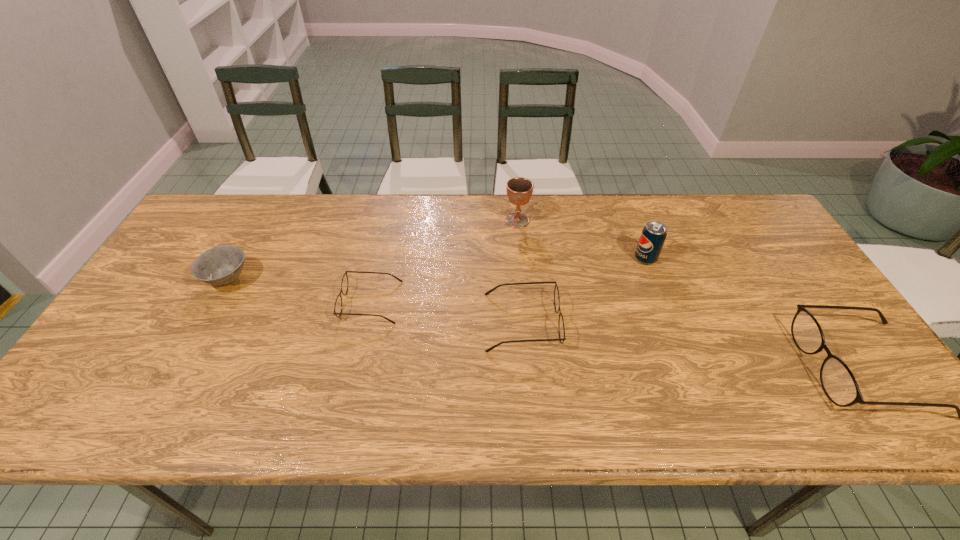
At what (x,y) coordinates should I click in order to perform the action: click on the fifth object from right to left. Please return your answer as a coordinate pair (x, y). The width and height of the screenshot is (960, 540). Looking at the image, I should click on (344, 284).

Find the location of `the shortest object`. the shortest object is located at coordinates (344, 284).

This screenshot has height=540, width=960. I want to click on the second shortest spectacles, so click(x=561, y=329).

This screenshot has height=540, width=960. I want to click on the leftmost object, so click(x=221, y=265).

Find the location of `the farthest object`. the farthest object is located at coordinates (519, 190).

Identify the location of the second object from right to left. (653, 235).

Locate an element on the screen. The height and width of the screenshot is (540, 960). the fifth shortest object is located at coordinates (653, 235).

The width and height of the screenshot is (960, 540). Find the location of `blank area located 0.140m on the front-facing side of the shortest spectacles`. blank area located 0.140m on the front-facing side of the shortest spectacles is located at coordinates (290, 302).

The height and width of the screenshot is (540, 960). I want to click on blank area located on the front-facing side of the shortest spectacles, so click(x=286, y=302).

Where is `free location located on the front-facing side of the shortest spectacles`? free location located on the front-facing side of the shortest spectacles is located at coordinates (215, 302).